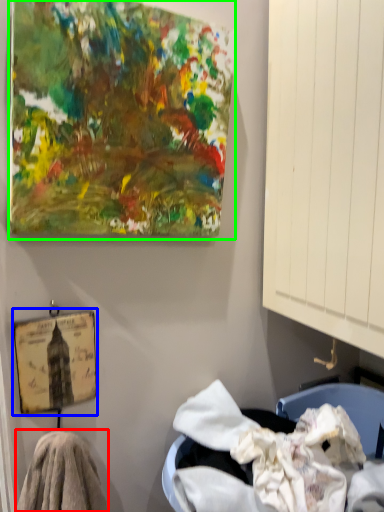
Question: Estimate the real-world distances between objects in this image. Which object is closer to material (highlighted by a red box), picture frame (highlighted by a blue box) or oil painting (highlighted by a green box)?

Choices:
 (A) picture frame
 (B) oil painting

Answer: (A)